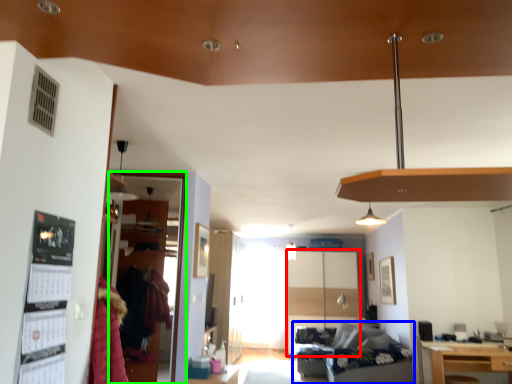
Question: Based on their relative distances, which object is farther from glass door (highlighted by a red box)? Choose from studio couch (highlighted by a blue box) and glass door (highlighted by a green box).

Choices:
 (A) studio couch
 (B) glass door

Answer: (B)